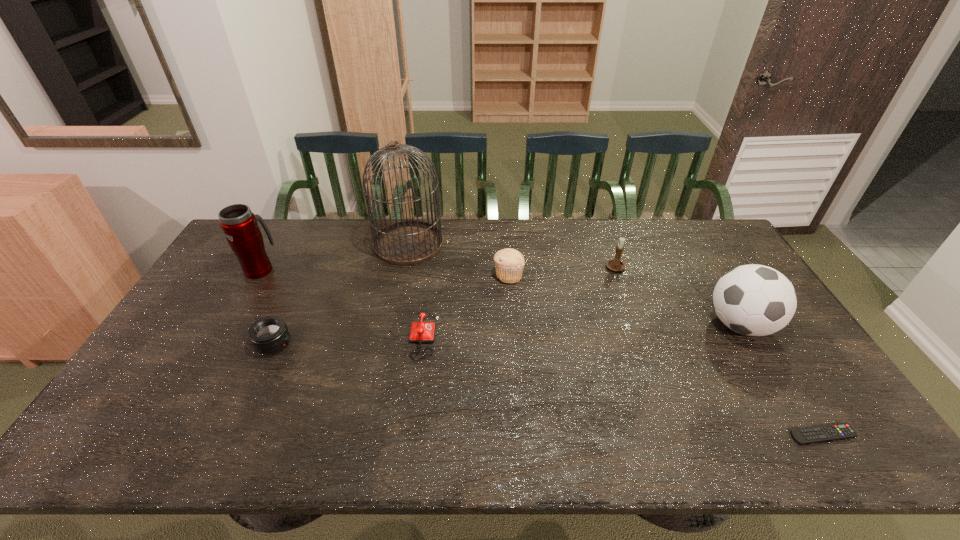
Where is `the tallest object`? The height and width of the screenshot is (540, 960). the tallest object is located at coordinates (411, 242).

At what (x,y) coordinates should I click in order to perform the action: click on the leftmost object. Please return your answer as a coordinate pair (x, y). Looking at the image, I should click on (239, 224).

Locate an element on the screen. Image resolution: width=960 pixels, height=540 pixels. the third tallest object is located at coordinates (755, 300).

At what (x,y) coordinates should I click in order to perform the action: click on candle holder. Please return your answer as a coordinate pair (x, y). The image size is (960, 540). Looking at the image, I should click on (616, 264).

You are a GUI agent. You are given a task and a screenshot of the screen. Output one action in this format:
    pyautogui.click(x=<x>, y=<y>)
    Task: Click on the third object from right to left
    
    Given the screenshot: What is the action you would take?
    pyautogui.click(x=616, y=264)

Identify the location of the fourth object from right to left. [509, 262].

Where is `muffin`? The width and height of the screenshot is (960, 540). muffin is located at coordinates (509, 262).

You are a GUI agent. You are given a task and a screenshot of the screen. Output one action in this format:
    pyautogui.click(x=<x>, y=<y>)
    Task: Click on the second object from left to right
    Image resolution: width=960 pixels, height=540 pixels.
    Given the screenshot: What is the action you would take?
    pyautogui.click(x=268, y=335)

Locate an element on the screen. The image size is (960, 540). the seventh tallest object is located at coordinates (421, 332).

Find the location of `the nearest object`. the nearest object is located at coordinates (808, 435).